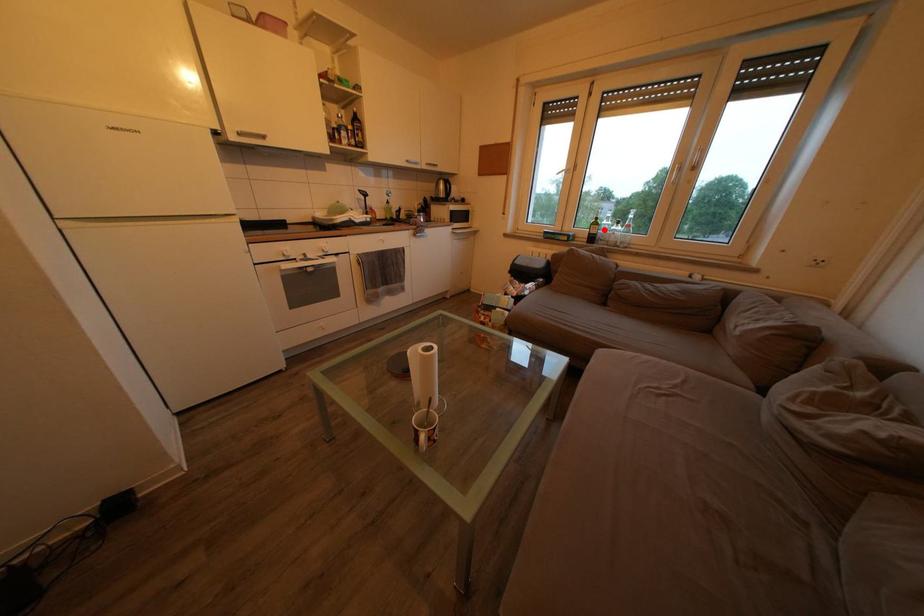
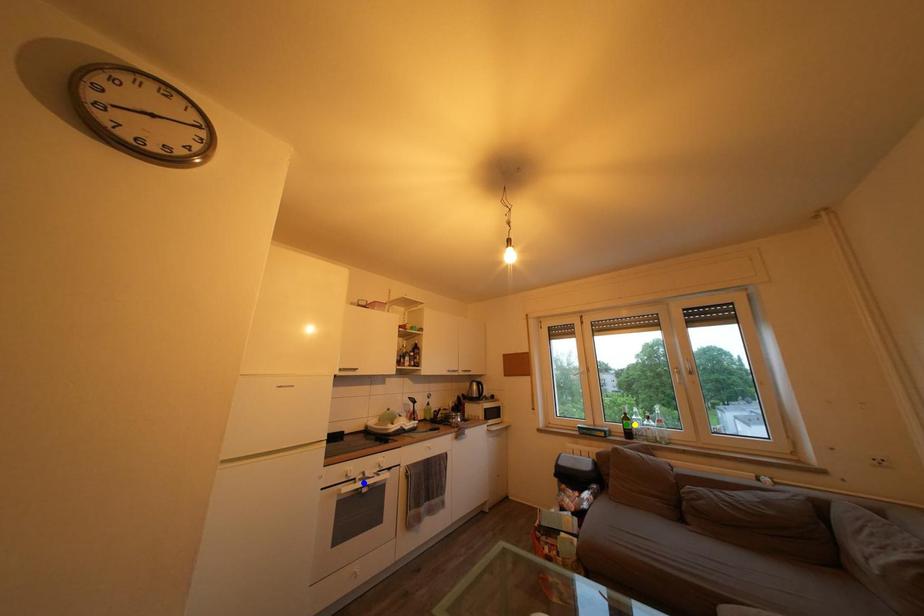
Question: I am providing you with two images of the same scene from different viewpoints. A red point is marked on the first image. You are given multiple points on the second image. In image 2, which mark is for the same physical point as the one in image 1?

Choices:
 (A) yellow point
 (B) blue point
 (C) green point

Answer: (A)